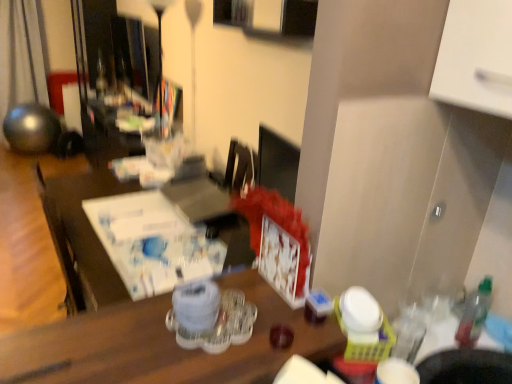
Question: From the image's perspective, is metallic sphere at left located above or below clear plastic tray at center?

Choices:
 (A) above
 (B) below

Answer: (A)

Question: From a real-world perspective, is metallic sphere at left physically located above or below clear plastic tray at center?

Choices:
 (A) above
 (B) below

Answer: (B)

Question: Considering the real-world distances, which object is closest to the metallic sphere at left?

Choices:
 (A) clear plastic tray at center
 (B) white paper at center
 (C) translucent plastic bottle at right

Answer: (B)

Question: Based on their relative distances, which object is farther from the translucent plastic bottle at right?

Choices:
 (A) white paper at center
 (B) clear plastic tray at center
 (C) metallic sphere at left

Answer: (C)